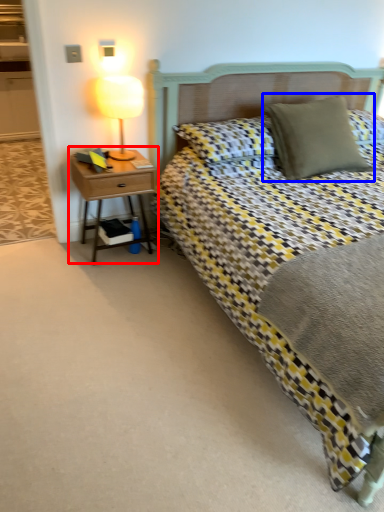
Question: Which point is closer to the camera, nightstand (highlighted by a red box) or pillow (highlighted by a blue box)?

Choices:
 (A) nightstand
 (B) pillow

Answer: (B)